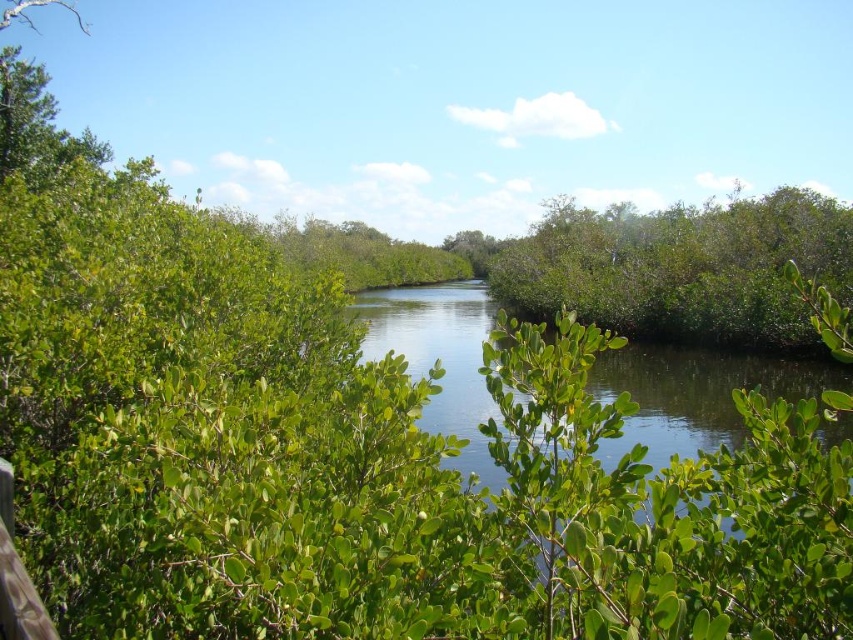
Is green leafy bush at center further to the viewer compared to green leafy river at center?

Yes.

From the picture: Is green leafy bush at center above green leafy river at center?

Indeed, green leafy bush at center is positioned over green leafy river at center.

Which is behind, point (709, 305) or point (421, 320)?

Positioned behind is point (421, 320).

I want to click on green leafy bush at center, so click(682, 268).